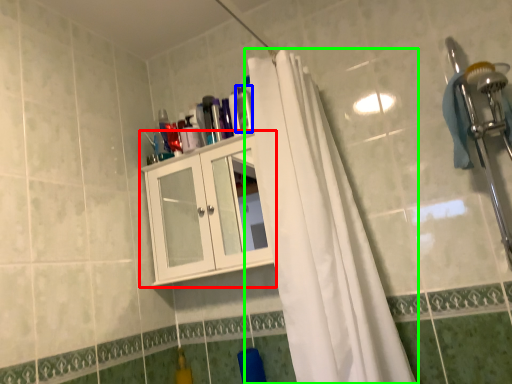
Question: Considering the real-world distances, which object is closest to cabinetry (highlighted by a red box)? toiletry (highlighted by a blue box) or curtain (highlighted by a green box).

Choices:
 (A) toiletry
 (B) curtain

Answer: (B)